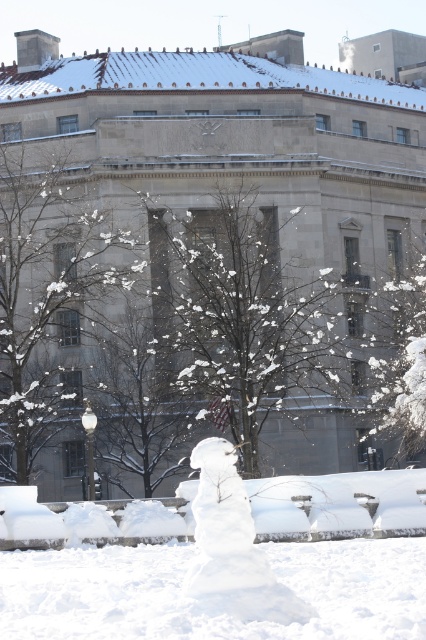
Question: Which of the following is the farthest from the observer?

Choices:
 (A) snow-covered tree at center
 (B) snowy bare tree at center

Answer: (A)

Question: Does snow-covered tree at center come behind snowy bare tree at center?

Choices:
 (A) yes
 (B) no

Answer: (A)

Question: Which point is closer to the camera?

Choices:
 (A) (173, 56)
 (B) (152, 556)
 (C) (233, 220)

Answer: (B)

Question: Which point is farther to the camera?

Choices:
 (A) white fluffy snowman at lower center
 (B) beige stone building at center

Answer: (B)

Question: In this image, where is beige stone building at center located relative to white fluffy snowman at lower center?

Choices:
 (A) right
 (B) left

Answer: (B)

Question: Is beige stone building at center above snow-covered branches at left?

Choices:
 (A) yes
 (B) no

Answer: (A)